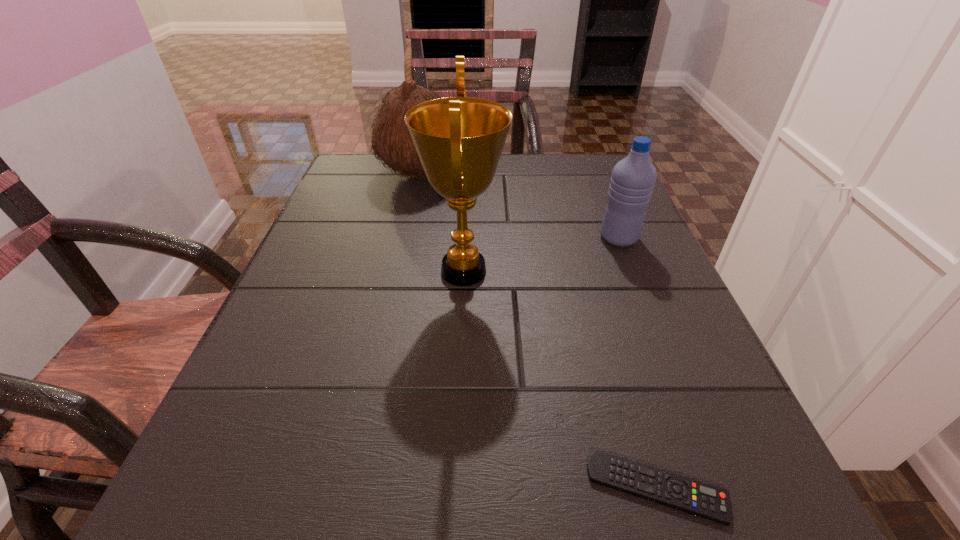
Where is `vacant space at the right edge of the desktop`? This screenshot has width=960, height=540. vacant space at the right edge of the desktop is located at coordinates (645, 242).

The image size is (960, 540). Identify the location of free space at the far left corner of the desktop. (352, 168).

Locate an element on the screen. Image resolution: width=960 pixels, height=540 pixels. free space at the near left corner of the desktop is located at coordinates (239, 481).

The height and width of the screenshot is (540, 960). I want to click on free space at the far right corner, so click(x=577, y=177).

This screenshot has width=960, height=540. In order to click on vacant space at the near right corner of the desktop in this screenshot , I will do `click(736, 492)`.

The image size is (960, 540). Identify the location of free space between the water bottle and the second tallest object. (518, 206).

Locate an element on the screen. free area in between the award and the remote control is located at coordinates (561, 379).

Where is `vacant space in between the remote control and the award`? vacant space in between the remote control and the award is located at coordinates (561, 379).

The width and height of the screenshot is (960, 540). I want to click on free spot between the award and the farthest object, so click(441, 222).

Identify the location of free space between the nearest object and the award. Image resolution: width=960 pixels, height=540 pixels. (561, 379).